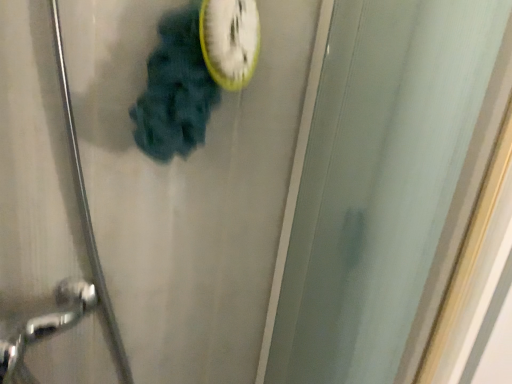
Question: Is transparent glass screen door at center in front of or behind white plastic clock at upper center in the image?

Choices:
 (A) front
 (B) behind

Answer: (A)

Question: From the image's perspective, is transparent glass screen door at center above or below white plastic clock at upper center?

Choices:
 (A) below
 (B) above

Answer: (A)

Question: Does point (289, 299) appear closer or farther from the camera than point (242, 26)?

Choices:
 (A) closer
 (B) farther

Answer: (B)

Question: Considering their positions, is white plastic clock at upper center located in front of or behind transparent glass screen door at center?

Choices:
 (A) front
 (B) behind

Answer: (B)

Question: Considering the positions of point (223, 74) and point (493, 117), is point (223, 74) closer or farther from the camera than point (493, 117)?

Choices:
 (A) farther
 (B) closer

Answer: (A)

Question: Based on their sizes in the image, would you say white plastic clock at upper center is bigger or smaller than transparent glass screen door at center?

Choices:
 (A) small
 (B) big

Answer: (A)

Question: Is white plastic clock at upper center situated inside transparent glass screen door at center or outside?

Choices:
 (A) outside
 (B) inside

Answer: (A)